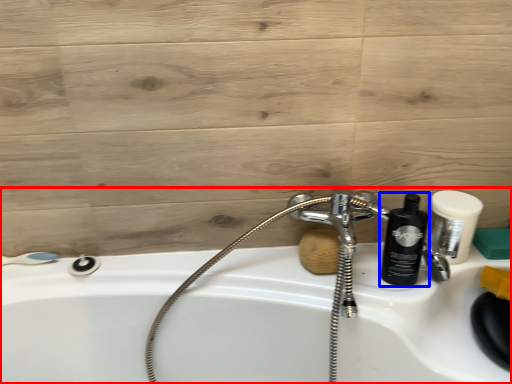
Question: Which point is closer to the camera, sink (highlighted by a red box) or shaving cream (highlighted by a blue box)?

Choices:
 (A) sink
 (B) shaving cream

Answer: (A)